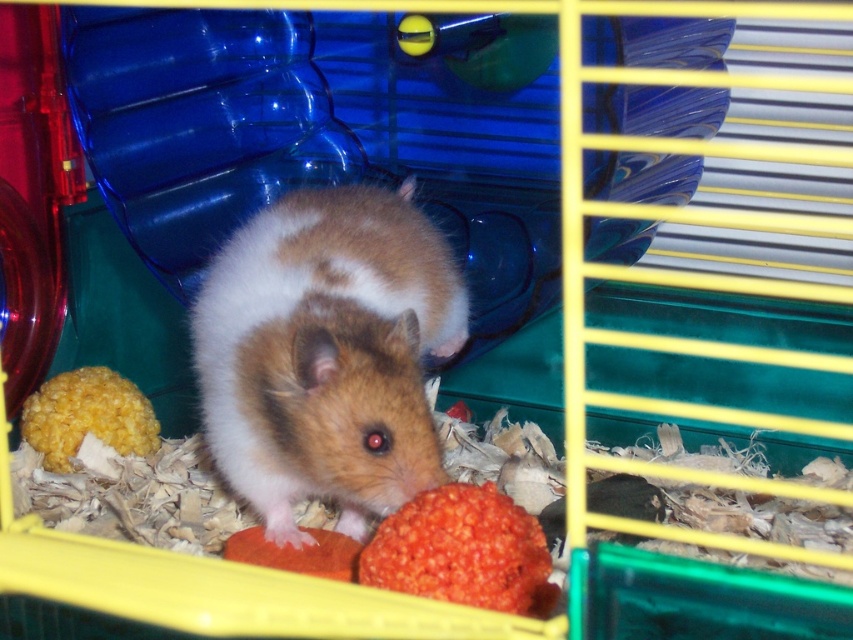
Image resolution: width=853 pixels, height=640 pixels. What do you see at coordinates (326, 353) in the screenshot?
I see `brown fuzzy hamster at center` at bounding box center [326, 353].

Is brown fuzzy hamster at center taller than yellow crumbly food at lower left?

Yes, brown fuzzy hamster at center is taller than yellow crumbly food at lower left.

Between point (285, 216) and point (65, 381), which one is positioned in front?

Point (285, 216)

The image size is (853, 640). Find the location of `brown fuzzy hamster at center`. brown fuzzy hamster at center is located at coordinates (326, 353).

In the scene shown: Between brown fuzzy hamster at center and orange textured ball at center, which one has more height?

With more height is brown fuzzy hamster at center.

Between brown fuzzy hamster at center and orange textured ball at center, which one appears on the left side from the viewer's perspective?

brown fuzzy hamster at center is more to the left.

Between point (415, 275) and point (532, 529), which one is positioned behind?

Positioned behind is point (415, 275).

Where is `brown fuzzy hamster at center`? This screenshot has width=853, height=640. brown fuzzy hamster at center is located at coordinates (326, 353).

Which is below, orange textured ball at center or yellow crumbly food at lower left?

Positioned lower is orange textured ball at center.

Which is more to the left, orange textured ball at center or yellow crumbly food at lower left?

From the viewer's perspective, yellow crumbly food at lower left appears more on the left side.

Where is `orange textured ball at center`? orange textured ball at center is located at coordinates (462, 552).